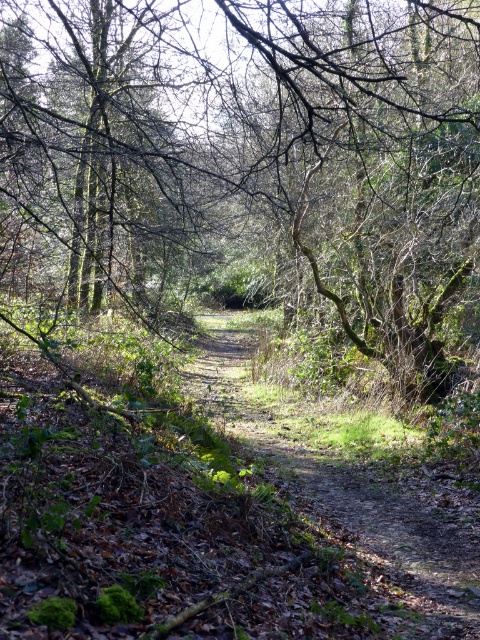
Consider the image. You are a hiker trying to navigate through the woodland scene. You need to walk along the dirt path at center. Is there enough space to walk around the green mossy tree at center without leaving the path?

The green mossy tree at center might be wider than dirt path at center, so there might not be enough space to walk around it without stepping off the path.

You are standing at the entrance of the woodland path and want to locate the green mossy tree at center. According to the coordinates provided, where should you look relative to your current position?

The green mossy tree at center is located at coordinates point (249, 154), which would be to the left and slightly forward from your current position at the entrance.

You are a hiker standing at the edge of the dirt path at center. You want to take a photo of the green mossy tree at center. Which direction should you face to ensure the tree is fully visible in your camera frame?

Since the green mossy tree at center is taller than the dirt path at center, you should face away from the dirt path at center towards the green mossy tree at center to ensure the entire tree is visible in your camera frame.